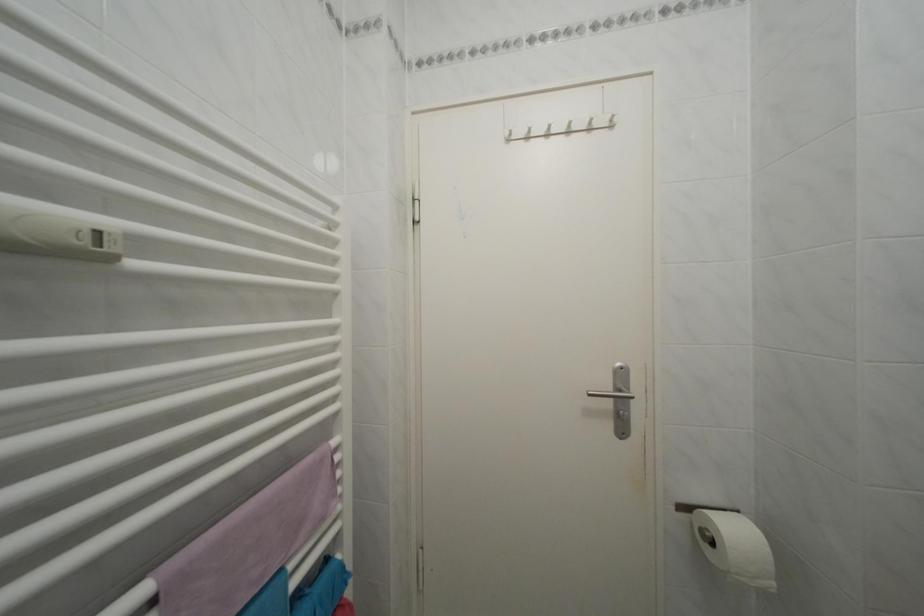
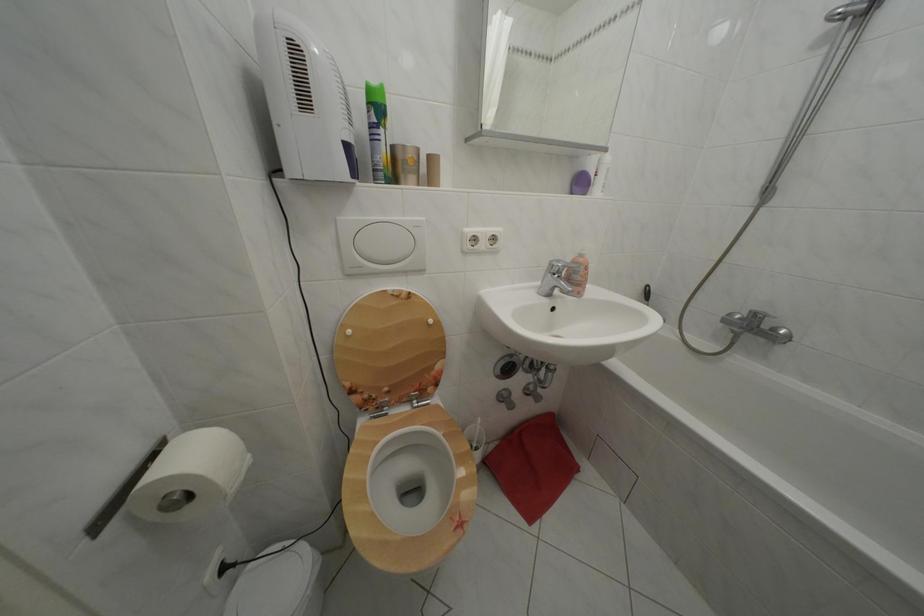
Locate, in the second image, the point that corresponds to pixel 723 549 in the first image.

(198, 504)